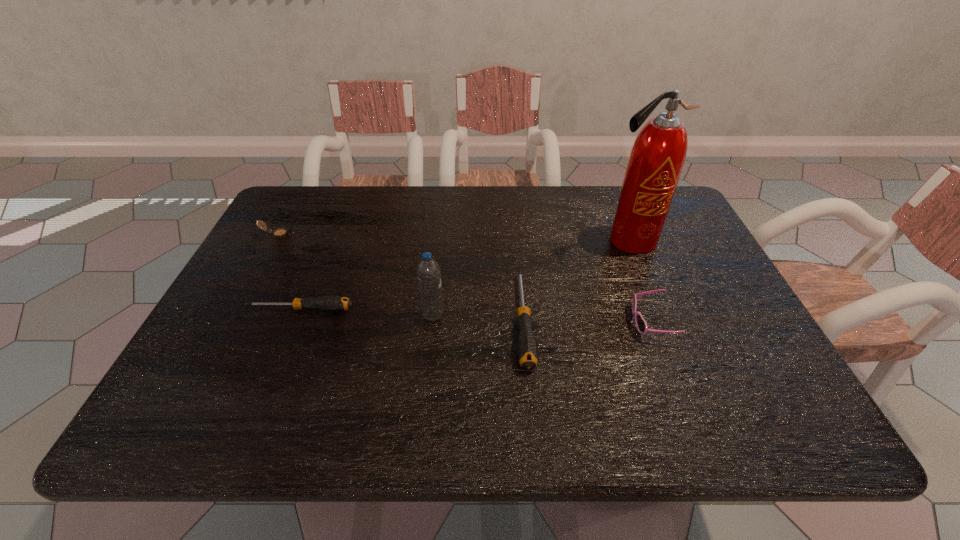
Find the location of a particular element. This screenshot has height=540, width=960. the shortest object is located at coordinates (332, 303).

What are the coordinates of `the left screwdriver` in the screenshot? It's located at (332, 303).

The height and width of the screenshot is (540, 960). What are the coordinates of `the right screwdriver` in the screenshot? It's located at (527, 350).

At what (x,y) coordinates should I click in order to perform the action: click on the taller screwdriver. Please return your answer as a coordinate pair (x, y). Image resolution: width=960 pixels, height=540 pixels. Looking at the image, I should click on (527, 350).

Where is `fire extinguisher`? The width and height of the screenshot is (960, 540). fire extinguisher is located at coordinates (x=657, y=157).

What are the coordinates of `compass` in the screenshot? It's located at (282, 232).

You are a GUI agent. You are given a task and a screenshot of the screen. Output one action in this format:
    pyautogui.click(x=<x>, y=<y>)
    Task: Click on the sunglasses
    Image resolution: width=960 pixels, height=540 pixels.
    Given the screenshot: What is the action you would take?
    (x=641, y=324)

I want to click on the fifth shortest object, so click(428, 271).

This screenshot has height=540, width=960. In order to click on water bottle in this screenshot , I will do `click(428, 271)`.

Where is `vacant area situated 0.350m on the back of the shorter screwdriver`? vacant area situated 0.350m on the back of the shorter screwdriver is located at coordinates (337, 219).